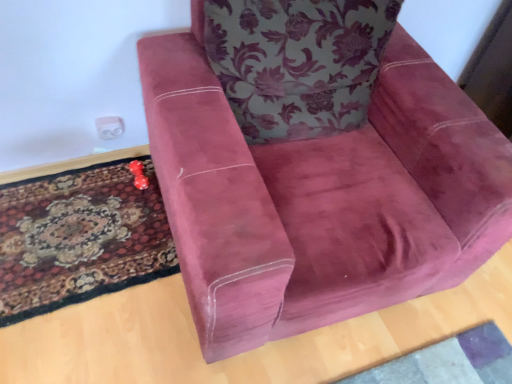
Question: Considering the relative sizes of carpeted rug at lower left and floral fabric cushion at upper center in the image provided, is carpeted rug at lower left shorter than floral fabric cushion at upper center?

Choices:
 (A) no
 (B) yes

Answer: (B)

Question: From a real-world perspective, is carpeted rug at lower left over floral fabric cushion at upper center?

Choices:
 (A) no
 (B) yes

Answer: (A)

Question: Does carpeted rug at lower left have a greater width compared to floral fabric cushion at upper center?

Choices:
 (A) yes
 (B) no

Answer: (A)

Question: From a real-world perspective, is carpeted rug at lower left located beneath floral fabric cushion at upper center?

Choices:
 (A) no
 (B) yes

Answer: (B)

Question: Is carpeted rug at lower left oriented away from floral fabric cushion at upper center?

Choices:
 (A) yes
 (B) no

Answer: (B)

Question: From the image's perspective, is carpeted rug at lower left under floral fabric cushion at upper center?

Choices:
 (A) no
 (B) yes

Answer: (B)

Question: Is floral fabric cushion at upper center completely or partially outside of carpeted rug at lower left?

Choices:
 (A) no
 (B) yes

Answer: (B)

Question: From a real-world perspective, is floral fabric cushion at upper center located higher than carpeted rug at lower left?

Choices:
 (A) no
 (B) yes

Answer: (B)

Question: Is floral fabric cushion at upper center at the left side of carpeted rug at lower left?

Choices:
 (A) no
 (B) yes

Answer: (A)

Question: From the image's perspective, would you say floral fabric cushion at upper center is positioned over carpeted rug at lower left?

Choices:
 (A) yes
 (B) no

Answer: (A)

Question: Is the position of floral fabric cushion at upper center more distant than that of carpeted rug at lower left?

Choices:
 (A) yes
 (B) no

Answer: (B)

Question: Is floral fabric cushion at upper center facing away from carpeted rug at lower left?

Choices:
 (A) yes
 (B) no

Answer: (B)

Question: Could you tell me if rubberized red dice at lower left is turned towards carpeted rug at lower left?

Choices:
 (A) yes
 (B) no

Answer: (B)